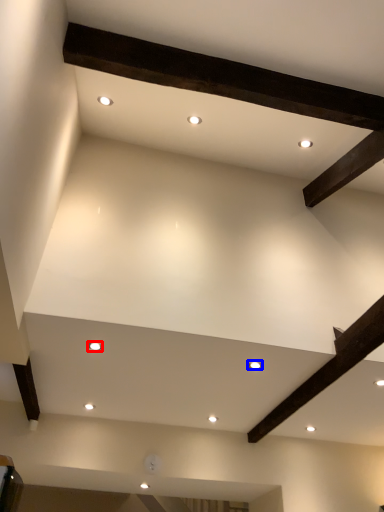
Question: Which point is closer to the camera, lighting (highlighted by a red box) or lighting (highlighted by a blue box)?

Choices:
 (A) lighting
 (B) lighting

Answer: (A)